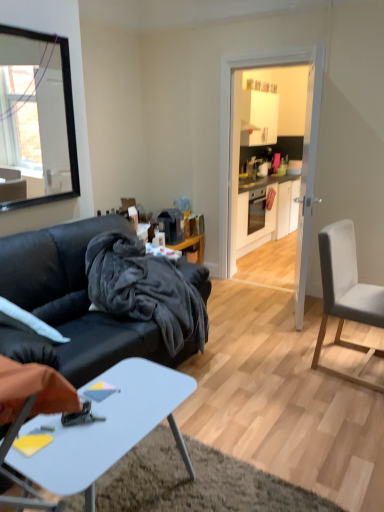
Question: Is white glossy door at center not within light gray fabric chair at right?

Choices:
 (A) no
 (B) yes

Answer: (B)

Question: Is white glossy door at center closer to camera compared to light gray fabric chair at right?

Choices:
 (A) yes
 (B) no

Answer: (B)

Question: From a real-world perspective, is white glossy door at center positioned under light gray fabric chair at right based on gravity?

Choices:
 (A) yes
 (B) no

Answer: (B)

Question: Is white glossy door at center smaller than light gray fabric chair at right?

Choices:
 (A) no
 (B) yes

Answer: (B)

Question: Is white glossy door at center bigger than light gray fabric chair at right?

Choices:
 (A) no
 (B) yes

Answer: (A)

Question: Looking at the image, does white glossy cabinet at center seem bigger or smaller compared to black fuzzy blanket at center?

Choices:
 (A) big
 (B) small

Answer: (A)

Question: Considering their positions, is white glossy cabinet at center located in front of or behind black fuzzy blanket at center?

Choices:
 (A) behind
 (B) front

Answer: (A)

Question: Choose the correct answer: Is white glossy cabinet at center inside black fuzzy blanket at center or outside it?

Choices:
 (A) outside
 (B) inside

Answer: (A)

Question: Considering the positions of white glossy cabinet at center and black fuzzy blanket at center in the image, is white glossy cabinet at center taller or shorter than black fuzzy blanket at center?

Choices:
 (A) short
 (B) tall

Answer: (B)

Question: Based on their sizes in the image, would you say velvet dark gray couch at left is bigger or smaller than black fuzzy blanket at center?

Choices:
 (A) big
 (B) small

Answer: (A)

Question: Is velvet dark gray couch at left to the left or to the right of black fuzzy blanket at center in the image?

Choices:
 (A) right
 (B) left

Answer: (A)

Question: In terms of height, does velvet dark gray couch at left look taller or shorter compared to black fuzzy blanket at center?

Choices:
 (A) tall
 (B) short

Answer: (A)

Question: From the image's perspective, is velvet dark gray couch at left above or below black fuzzy blanket at center?

Choices:
 (A) below
 (B) above

Answer: (A)

Question: Relative to white plastic desk at lower center, is white glossy cabinet at center in front or behind?

Choices:
 (A) behind
 (B) front

Answer: (A)

Question: Is white glossy cabinet at center inside or outside of white plastic desk at lower center?

Choices:
 (A) outside
 (B) inside

Answer: (A)